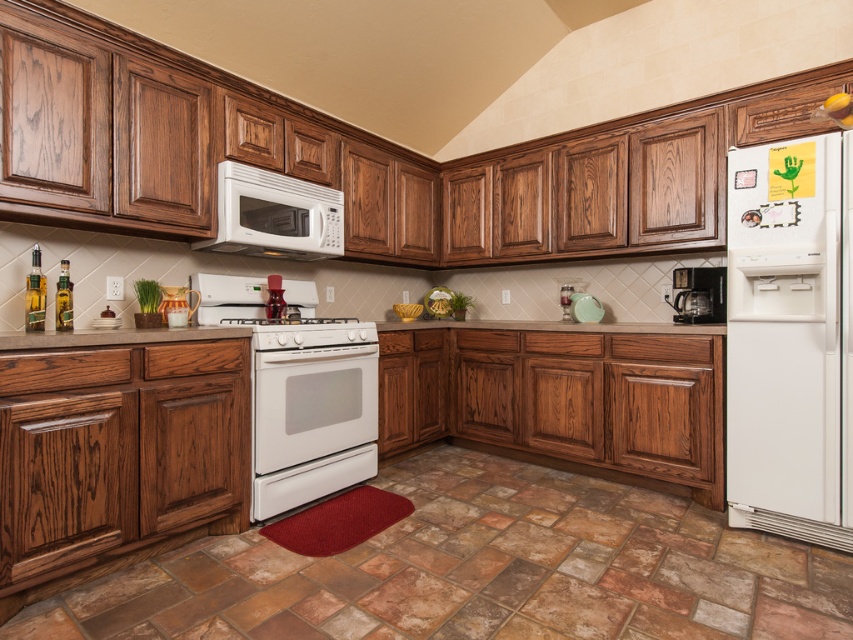
Question: Does brown wood countertop at center come in front of white glossy stove at center?

Choices:
 (A) no
 (B) yes

Answer: (B)

Question: Where is white glossy refrigerator at right located in relation to white glossy oven at center in the image?

Choices:
 (A) right
 (B) left

Answer: (A)

Question: Is white glossy refrigerator at right above brown wood countertop at center?

Choices:
 (A) yes
 (B) no

Answer: (B)

Question: Which point appears farthest from the camera in this image?

Choices:
 (A) (724, 289)
 (B) (846, 192)

Answer: (A)

Question: Which point is farther from the camera taking this photo?

Choices:
 (A) (817, 380)
 (B) (289, 410)

Answer: (B)

Question: Which point is closer to the camera?

Choices:
 (A) black plastic coffee maker at right
 (B) brown wood countertop at center

Answer: (B)